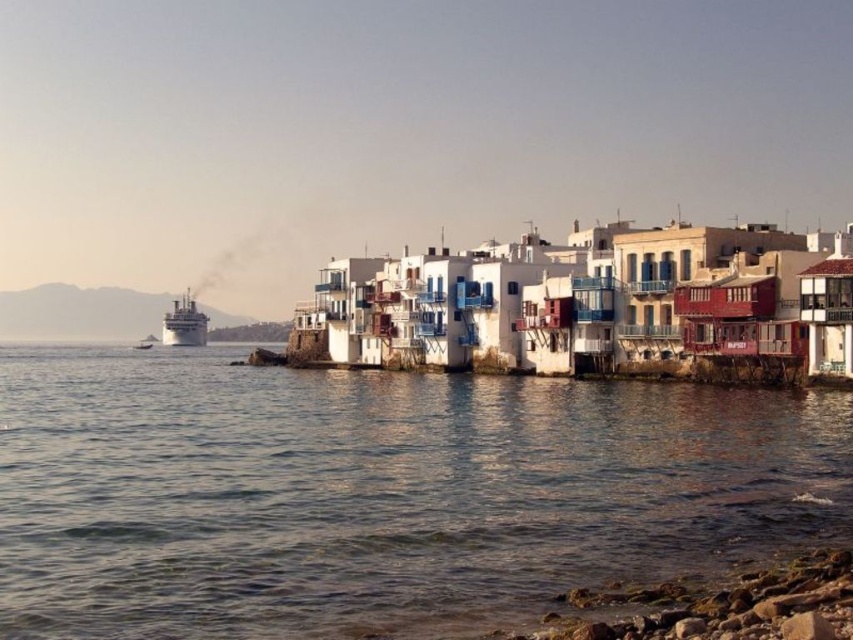
Question: Estimate the real-world distances between objects in this image. Which object is closer to the shiny silver cruise ship at left?

Choices:
 (A) white painted wood houses at center
 (B) clear water at lower left

Answer: (A)

Question: Does white painted wood houses at center appear on the left side of shiny silver cruise ship at left?

Choices:
 (A) yes
 (B) no

Answer: (B)

Question: Is clear water at lower left to the left of white painted wood houses at center from the viewer's perspective?

Choices:
 (A) yes
 (B) no

Answer: (A)

Question: Which object is closer to the camera taking this photo?

Choices:
 (A) white painted wood houses at center
 (B) clear water at lower left
 (C) shiny silver cruise ship at left

Answer: (B)

Question: Which point is farther to the camera?

Choices:
 (A) (544, 333)
 (B) (207, 552)
 (C) (207, 321)

Answer: (C)

Question: Where is clear water at lower left located in relation to shiny silver cruise ship at left in the image?

Choices:
 (A) below
 (B) above

Answer: (A)